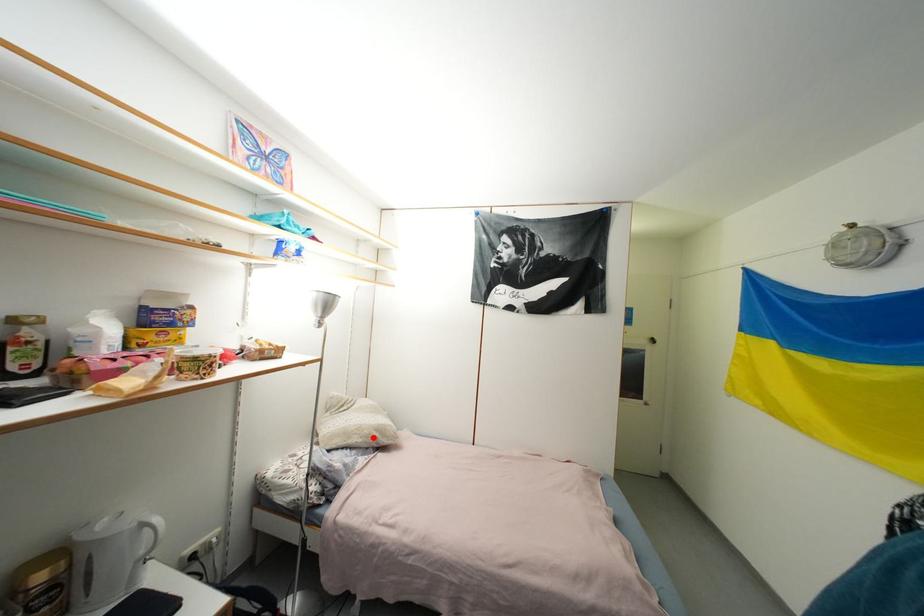
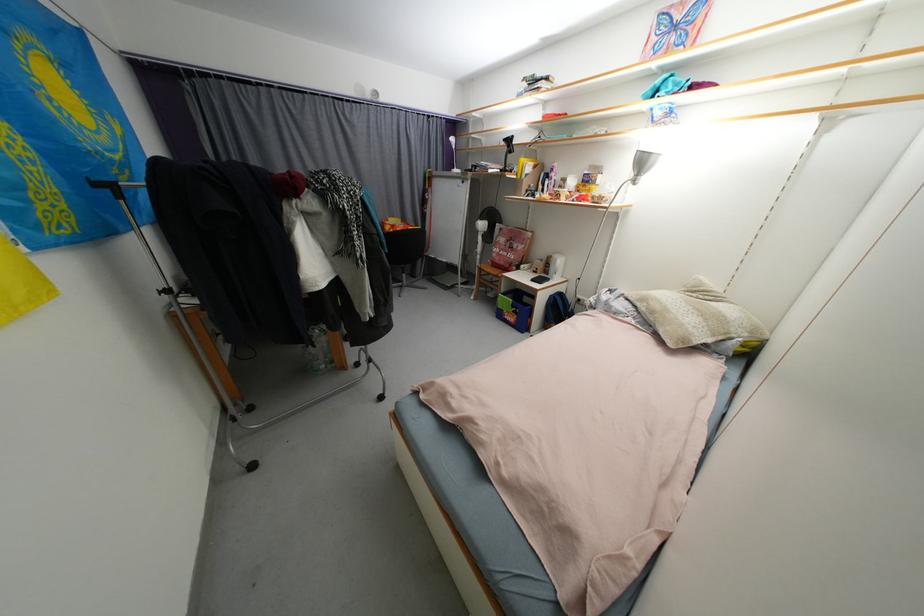
Where in the second image is the point corresponding to the highlighted location from the first image?

(658, 314)